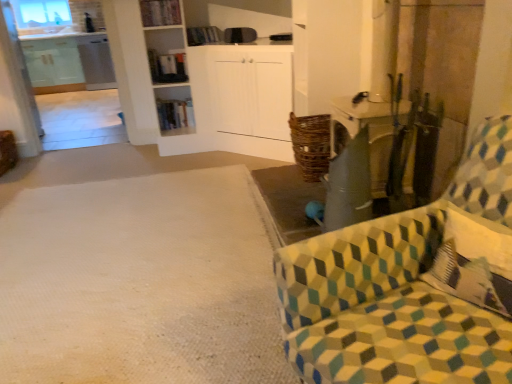
You are a GUI agent. You are given a task and a screenshot of the screen. Output one action in this format:
    pyautogui.click(x=<x>, y=<y>)
    Task: Click on the free space above white textured carpet at lower left (from a real-world perspective)
    This screenshot has width=512, height=384.
    Given the screenshot: What is the action you would take?
    pyautogui.click(x=97, y=267)